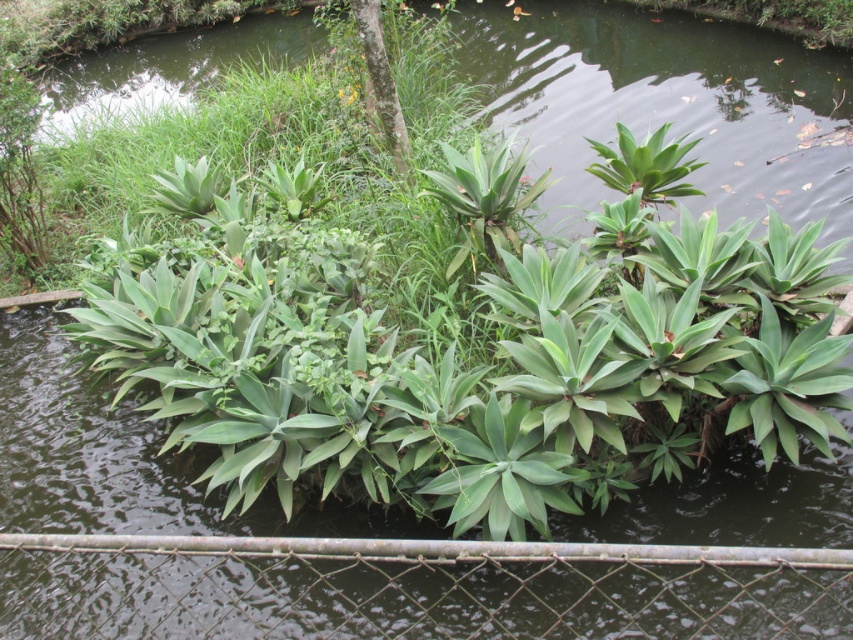
Does rusty metal fence at lower center appear under green leafy tree at upper center?

Indeed, rusty metal fence at lower center is positioned under green leafy tree at upper center.

Which is more to the left, rusty metal fence at lower center or green leafy tree at upper center?

Positioned to the left is green leafy tree at upper center.

Who is more forward, (664, 548) or (375, 4)?

Point (664, 548) is more forward.

Locate an element on the screen. This screenshot has width=853, height=640. rusty metal fence at lower center is located at coordinates (413, 588).

Which of these two, green leafy plant at center or green leafy tree at upper center, stands shorter?

With less height is green leafy tree at upper center.

Between point (466, 378) and point (387, 84), which one is positioned in front?

Point (466, 378) is in front.

Locate an element on the screen. green leafy plant at center is located at coordinates click(x=241, y=406).

The width and height of the screenshot is (853, 640). In order to click on rusty metal fence at lower center in this screenshot , I will do `click(413, 588)`.

Does rusty metal fence at lower center have a greater width compared to green leafy plant at center?

No, rusty metal fence at lower center is not wider than green leafy plant at center.

Between point (357, 582) and point (219, 420), which one is positioned in front?

Point (219, 420) is in front.

This screenshot has height=640, width=853. What are the coordinates of `rusty metal fence at lower center` in the screenshot? It's located at (413, 588).